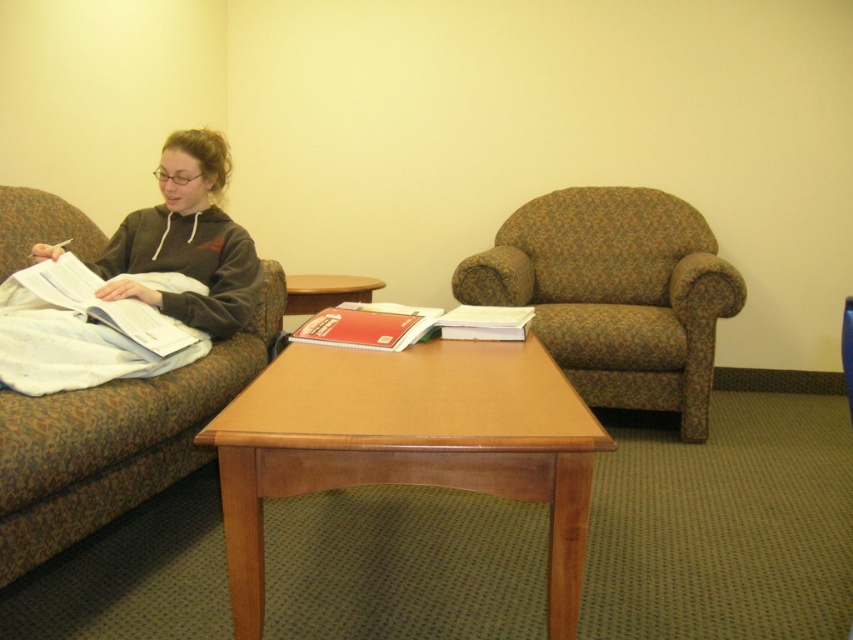
Question: Does light brown wood table at center lie in front of wooden side table at center?

Choices:
 (A) yes
 (B) no

Answer: (A)

Question: Which object is farther from the camera taking this photo?

Choices:
 (A) white paper book at center
 (B) brown fabric couch at left
 (C) light brown wood table at center

Answer: (A)

Question: Which object is farther from the camera taking this photo?

Choices:
 (A) light brown wood table at center
 (B) red matte book at center
 (C) brown floral fabric armchair at center-right
 (D) brown fabric couch at left

Answer: (C)

Question: Which object appears farthest from the camera in this image?

Choices:
 (A) white paper book at left
 (B) light brown wood table at center
 (C) white paper book at center
 (D) brown fabric couch at left

Answer: (C)

Question: From the image, what is the correct spatial relationship of light brown wood table at center in relation to white paper book at left?

Choices:
 (A) left
 (B) right

Answer: (B)

Question: Is white paper book at left wider than red matte book at center?

Choices:
 (A) yes
 (B) no

Answer: (A)